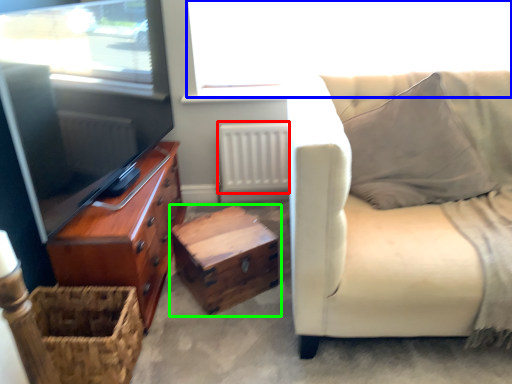
Question: Estimate the real-world distances between objects in this image. Which object is closer to radiator (highlighted by a red box), window screen (highlighted by a blue box) or table (highlighted by a green box)?

Choices:
 (A) window screen
 (B) table

Answer: (A)